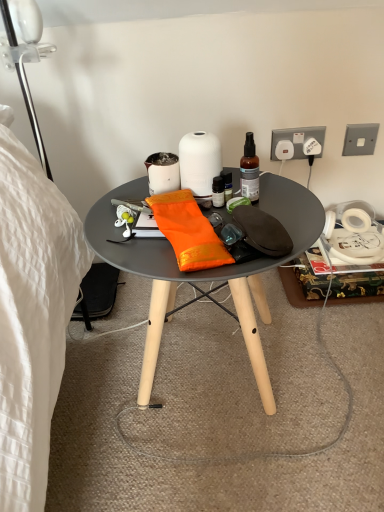
The width and height of the screenshot is (384, 512). Find the location of `free space underneath matte black table at center (from a real-world perspective)`. free space underneath matte black table at center (from a real-world perspective) is located at coordinates (208, 373).